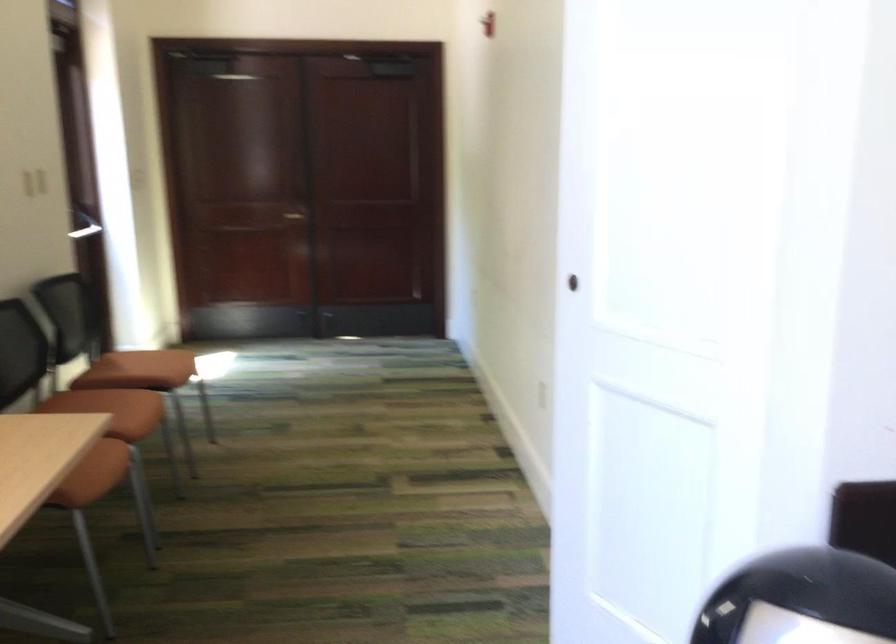
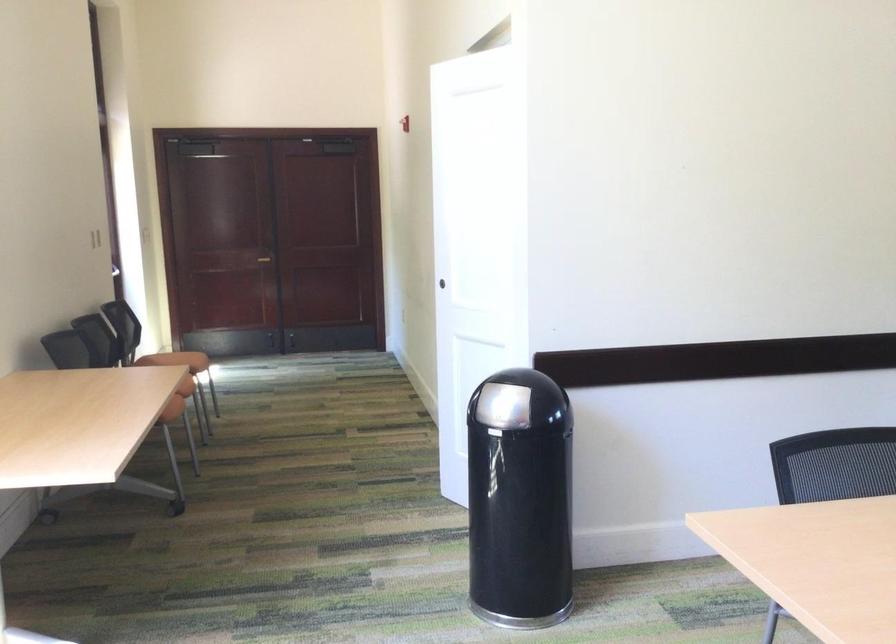
Question: The images are taken continuously from a first-person perspective. In which direction are you moving?

Choices:
 (A) Left
 (B) Right
 (C) Forward
 (D) Backward

Answer: (D)